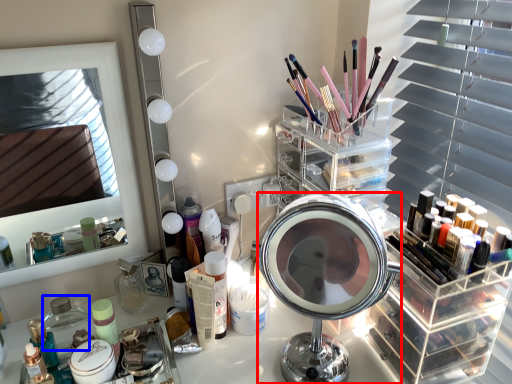
Question: Which point is further to the camera, mirror (highlighted by a red box) or toiletry (highlighted by a blue box)?

Choices:
 (A) mirror
 (B) toiletry

Answer: (B)